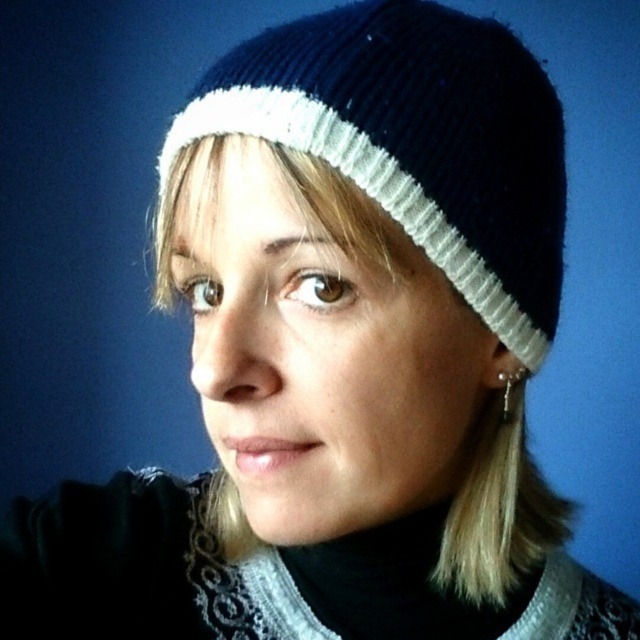
Question: Does navy blue knitted hat at center have a greater width compared to silver metallic earring at lower right?

Choices:
 (A) no
 (B) yes

Answer: (B)

Question: Is navy blue knitted hat at center above silver metallic earring at lower right?

Choices:
 (A) no
 (B) yes

Answer: (B)

Question: Which of the following is the farthest from the observer?

Choices:
 (A) (273, 35)
 (B) (515, 384)

Answer: (B)

Question: Is navy blue knitted hat at center to the right of silver metallic earring at lower right from the viewer's perspective?

Choices:
 (A) no
 (B) yes

Answer: (A)